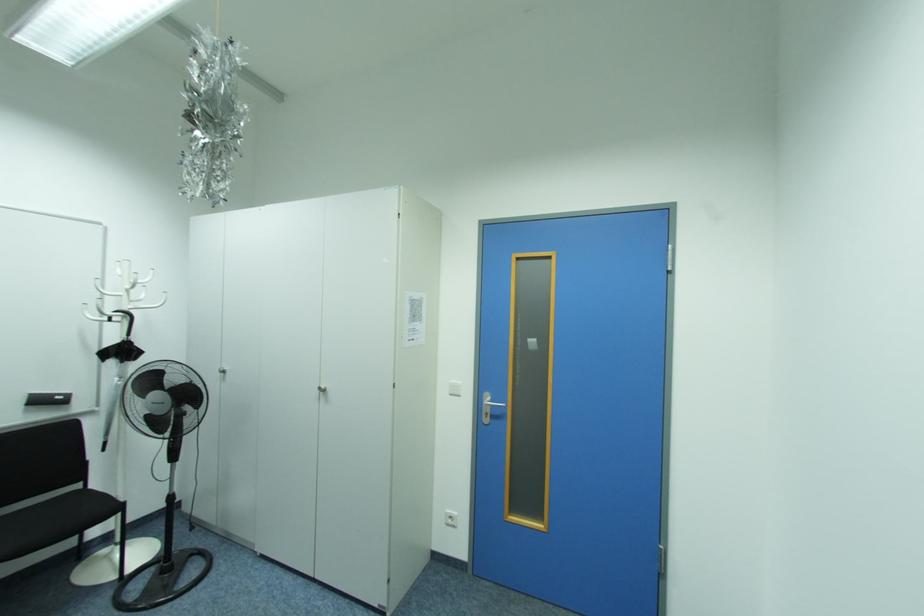
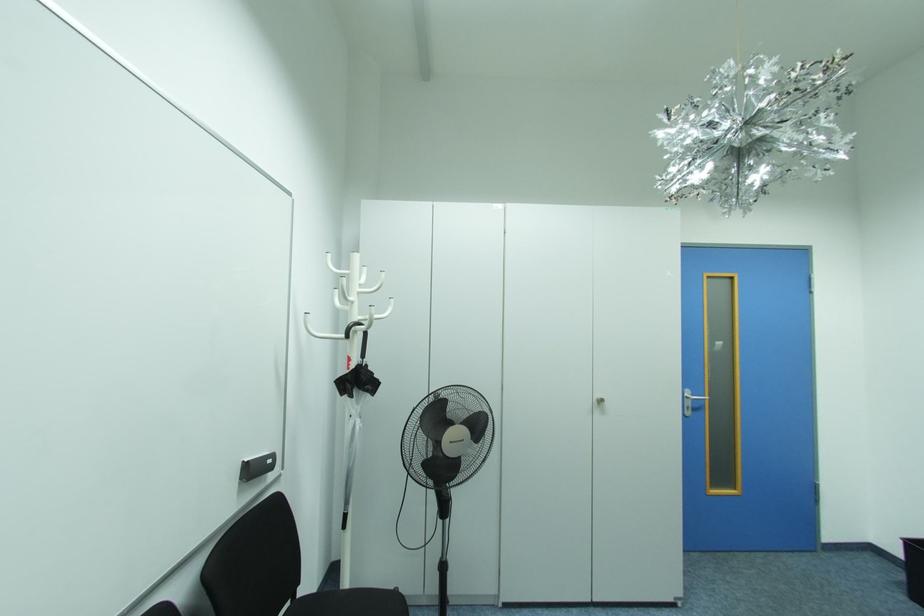
Question: Which direction would the cameraman need to move to produce the second image? Reply with the corresponding letter.

Choices:
 (A) Left
 (B) Right
 (C) Forward
 (D) Backward

Answer: (A)